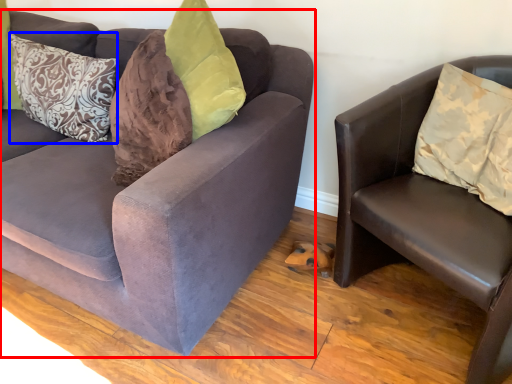
Question: Among these objects, which one is farthest to the camera, studio couch (highlighted by a red box) or pillow (highlighted by a blue box)?

Choices:
 (A) studio couch
 (B) pillow

Answer: (B)